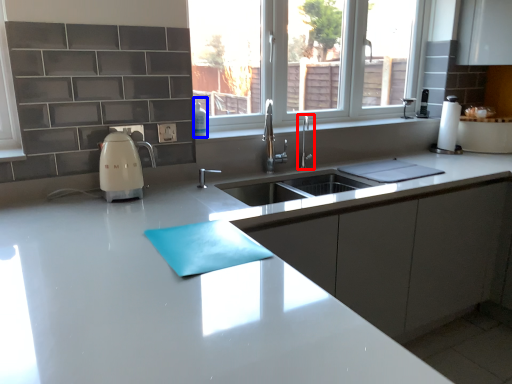
Question: Which object is closer to the camera taking this photo, tap (highlighted by a red box) or soap dispenser (highlighted by a blue box)?

Choices:
 (A) tap
 (B) soap dispenser

Answer: (B)